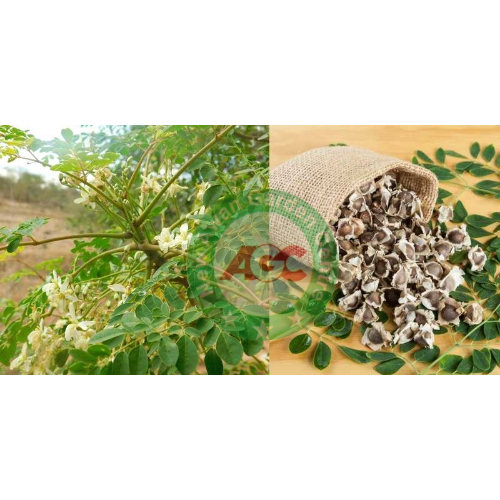
Locate an element on the screen. This screenshot has height=500, width=500. fresh flowers is located at coordinates (74, 328), (56, 289), (172, 239), (189, 235), (175, 188), (80, 196), (22, 357).